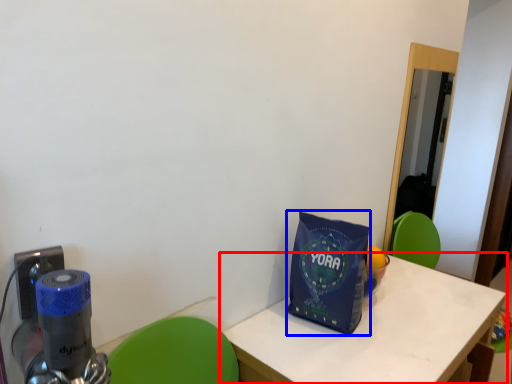
Question: Which object appears closest to the camera in this image, table (highlighted by a red box) or tote bag (highlighted by a blue box)?

Choices:
 (A) table
 (B) tote bag

Answer: (A)